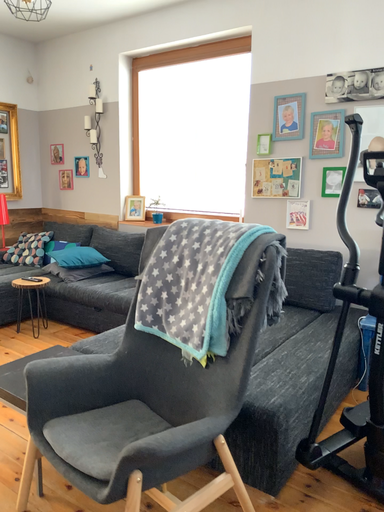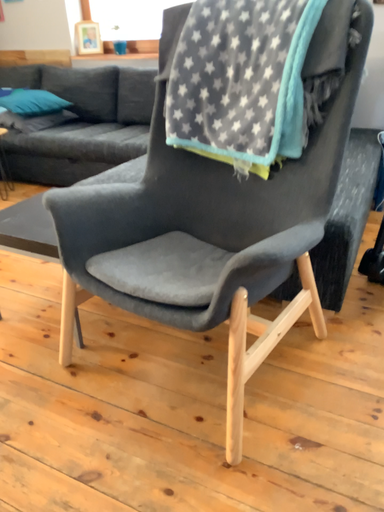
Question: How did the camera likely rotate when shooting the video?

Choices:
 (A) rotated right
 (B) rotated left

Answer: (A)